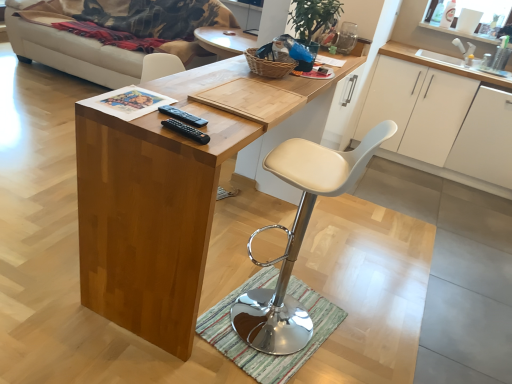
Question: Is white leather stool at center smaller than white matte cabinet at right, marked as the first cabinetry in a right-to-left arrangement?

Choices:
 (A) yes
 (B) no

Answer: (A)

Question: From a real-world perspective, is white leather stool at center physically above white matte cabinet at right, marked as the first cabinetry in a right-to-left arrangement?

Choices:
 (A) no
 (B) yes

Answer: (B)

Question: From the image's perspective, is white leather stool at center over white matte cabinet at right, which appears as the second cabinetry when viewed from the left?

Choices:
 (A) no
 (B) yes

Answer: (A)

Question: Considering the relative sizes of white leather stool at center and white matte cabinet at right, which appears as the second cabinetry when viewed from the left, in the image provided, is white leather stool at center bigger than white matte cabinet at right, which appears as the second cabinetry when viewed from the left,?

Choices:
 (A) no
 (B) yes

Answer: (A)

Question: From the image's perspective, is white leather stool at center below white matte cabinet at right, which appears as the second cabinetry when viewed from the left?

Choices:
 (A) no
 (B) yes

Answer: (B)

Question: Considering their positions, is white leather stool at center located in front of or behind beige fabric couch at upper left?

Choices:
 (A) behind
 (B) front

Answer: (B)

Question: Considering the positions of white leather stool at center and beige fabric couch at upper left in the image, is white leather stool at center taller or shorter than beige fabric couch at upper left?

Choices:
 (A) short
 (B) tall

Answer: (B)

Question: Would you say white leather stool at center is to the left or to the right of beige fabric couch at upper left in the picture?

Choices:
 (A) left
 (B) right

Answer: (B)

Question: Is point (271, 165) positioned closer to the camera than point (158, 6)?

Choices:
 (A) farther
 (B) closer

Answer: (B)

Question: Is white matte cabinet at upper right, acting as the first cabinetry starting from the left, taller or shorter than wooden desk at center?

Choices:
 (A) tall
 (B) short

Answer: (B)

Question: Considering the positions of white matte cabinet at upper right, acting as the first cabinetry starting from the left, and wooden desk at center in the image, is white matte cabinet at upper right, acting as the first cabinetry starting from the left, wider or thinner than wooden desk at center?

Choices:
 (A) thin
 (B) wide

Answer: (B)

Question: In terms of size, does white matte cabinet at upper right, acting as the first cabinetry starting from the left, appear bigger or smaller than wooden desk at center?

Choices:
 (A) big
 (B) small

Answer: (A)

Question: Choose the correct answer: Is white matte cabinet at upper right, which is the second cabinetry in right-to-left order, inside wooden desk at center or outside it?

Choices:
 (A) inside
 (B) outside

Answer: (B)

Question: In the image, is beige fabric couch at upper left positioned in front of or behind white matte cabinet at upper right, acting as the first cabinetry starting from the left?

Choices:
 (A) front
 (B) behind

Answer: (B)

Question: Would you say beige fabric couch at upper left is to the left or to the right of white matte cabinet at upper right, acting as the first cabinetry starting from the left, in the picture?

Choices:
 (A) right
 (B) left

Answer: (B)